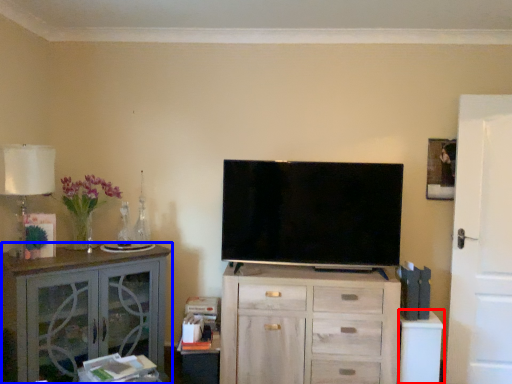
Question: Which point is further to the camera, table (highlighted by a red box) or cabinetry (highlighted by a blue box)?

Choices:
 (A) table
 (B) cabinetry

Answer: (A)